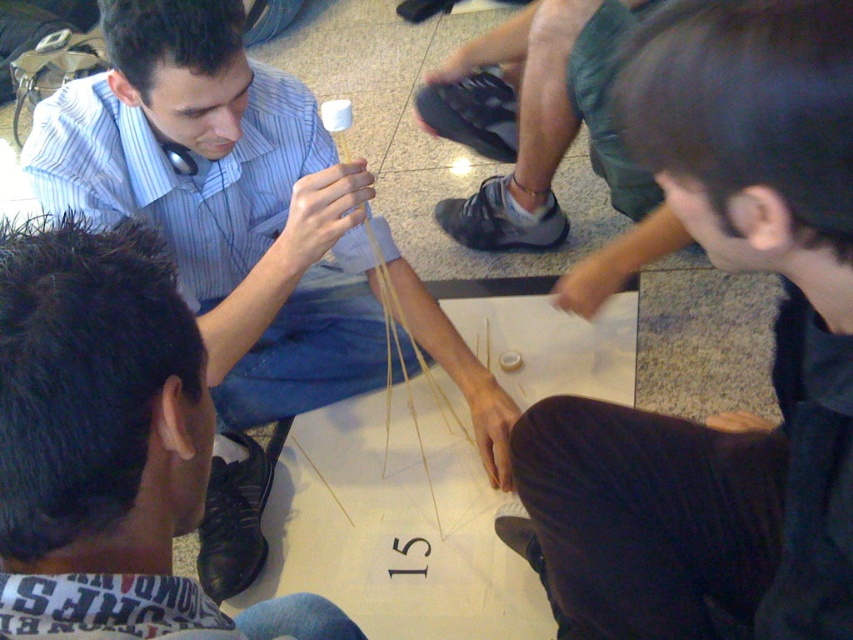
Question: Considering the real-world distances, which object is closest to the dark brown leather jacket at lower right?

Choices:
 (A) matte blue shirt at center
 (B) dark blue jeans at lower left

Answer: (B)

Question: Considering the relative positions of dark brown leather jacket at lower right and matte blue shirt at center in the image provided, where is dark brown leather jacket at lower right located with respect to matte blue shirt at center?

Choices:
 (A) above
 (B) below

Answer: (B)

Question: Is dark brown leather jacket at lower right bigger than matte blue shirt at center?

Choices:
 (A) yes
 (B) no

Answer: (B)

Question: Does dark brown leather jacket at lower right have a smaller size compared to matte blue shirt at center?

Choices:
 (A) no
 (B) yes

Answer: (B)

Question: Considering the real-world distances, which object is farthest from the dark blue jeans at lower left?

Choices:
 (A) dark brown leather jacket at lower right
 (B) matte blue shirt at center

Answer: (B)

Question: Estimate the real-world distances between objects in this image. Which object is closer to the dark brown leather jacket at lower right?

Choices:
 (A) matte blue shirt at center
 (B) dark blue jeans at lower left

Answer: (B)